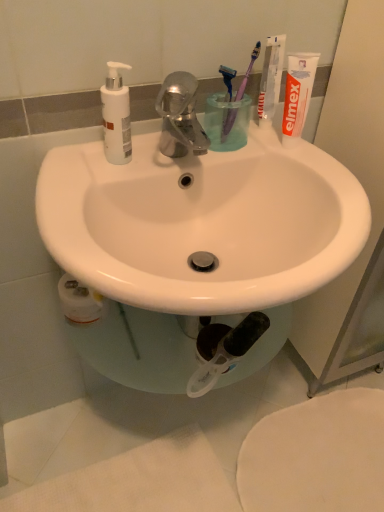
Question: Does transparent plastic cup at center have a lesser height compared to white matte bidet at lower right?

Choices:
 (A) yes
 (B) no

Answer: (B)

Question: Does transparent plastic cup at center have a lesser width compared to white matte bidet at lower right?

Choices:
 (A) yes
 (B) no

Answer: (A)

Question: Does transparent plastic cup at center touch white matte bidet at lower right?

Choices:
 (A) no
 (B) yes

Answer: (A)

Question: Is transparent plastic cup at center not near white matte bidet at lower right?

Choices:
 (A) yes
 (B) no

Answer: (B)

Question: From a real-world perspective, is transparent plastic cup at center positioned under white matte bidet at lower right based on gravity?

Choices:
 (A) yes
 (B) no

Answer: (B)

Question: Considering the positions of purple plastic toothbrush at upper right, positioned as the first toothbrush in left-to-right order, and white matte bidet at lower right in the image, is purple plastic toothbrush at upper right, positioned as the first toothbrush in left-to-right order, wider or thinner than white matte bidet at lower right?

Choices:
 (A) wide
 (B) thin

Answer: (B)

Question: Considering their positions, is purple plastic toothbrush at upper right, which is the 2th toothbrush from right to left, located in front of or behind white matte bidet at lower right?

Choices:
 (A) front
 (B) behind

Answer: (A)

Question: From the image's perspective, is purple plastic toothbrush at upper right, which is the 2th toothbrush from right to left, positioned above or below white matte bidet at lower right?

Choices:
 (A) below
 (B) above

Answer: (B)

Question: Considering the positions of purple plastic toothbrush at upper right, positioned as the first toothbrush in left-to-right order, and white matte bidet at lower right in the image, is purple plastic toothbrush at upper right, positioned as the first toothbrush in left-to-right order, bigger or smaller than white matte bidet at lower right?

Choices:
 (A) big
 (B) small

Answer: (B)

Question: Do you think white matte bidet at lower right is within white glossy sink at center, or outside of it?

Choices:
 (A) outside
 (B) inside

Answer: (A)

Question: In terms of height, does white matte bidet at lower right look taller or shorter compared to white glossy sink at center?

Choices:
 (A) tall
 (B) short

Answer: (B)

Question: From a real-world perspective, relative to white glossy sink at center, is white matte bidet at lower right vertically above or below?

Choices:
 (A) below
 (B) above

Answer: (A)

Question: Would you say white matte bidet at lower right is to the left or to the right of white glossy sink at center in the picture?

Choices:
 (A) right
 (B) left

Answer: (A)

Question: Looking at the image, does purple plastic toothbrush at upper right, the second toothbrush viewed from the left, seem bigger or smaller compared to transparent plastic cup at center?

Choices:
 (A) small
 (B) big

Answer: (A)

Question: Considering the positions of purple plastic toothbrush at upper right, the second toothbrush viewed from the left, and transparent plastic cup at center in the image, is purple plastic toothbrush at upper right, the second toothbrush viewed from the left, taller or shorter than transparent plastic cup at center?

Choices:
 (A) tall
 (B) short

Answer: (A)